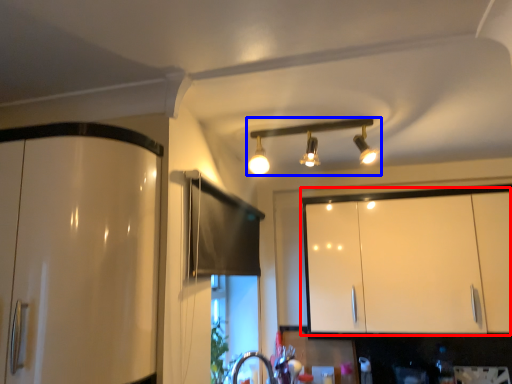
Question: Which of the following is the closest to the observer, cabinetry (highlighted by a red box) or lamp (highlighted by a blue box)?

Choices:
 (A) cabinetry
 (B) lamp

Answer: (B)